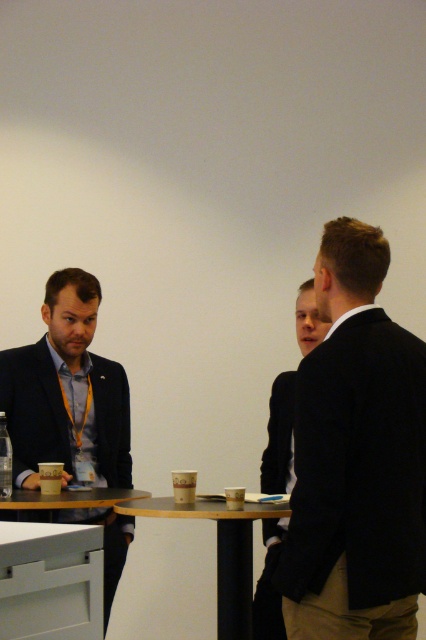
Question: Is matte black suit at left bigger than wooden table at center?

Choices:
 (A) yes
 (B) no

Answer: (A)

Question: Which object is farther from the camera taking this photo?

Choices:
 (A) dark suit jacket at center
 (B) black matte suit at center
 (C) white glossy table at lower left

Answer: (C)

Question: Which point is farther to the camera?

Choices:
 (A) matte black suit at left
 (B) dark suit jacket at center

Answer: (A)

Question: Which point is closer to the camera?

Choices:
 (A) dark suit jacket at center
 (B) matte black suit at left
 (C) wooden table at center
 (D) black suit at right

Answer: (D)

Question: Where is matte black suit at left located in relation to white glossy table at lower left in the image?

Choices:
 (A) right
 (B) left

Answer: (B)

Question: Considering the relative positions of matte black suit at left and wooden table at center in the image provided, where is matte black suit at left located with respect to wooden table at center?

Choices:
 (A) right
 (B) left

Answer: (B)